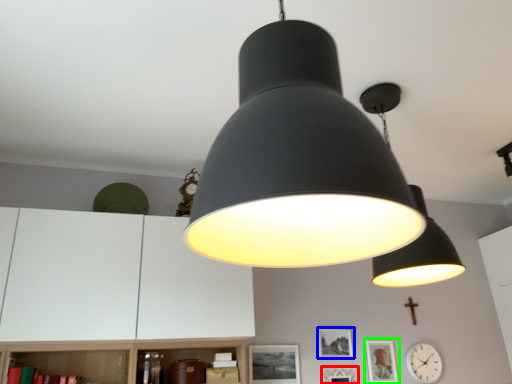
Question: Which object is the farthest from picture frame (highlighted by a red box)? Choose among these: picture frame (highlighted by a blue box) or picture frame (highlighted by a green box).

Choices:
 (A) picture frame
 (B) picture frame

Answer: (B)